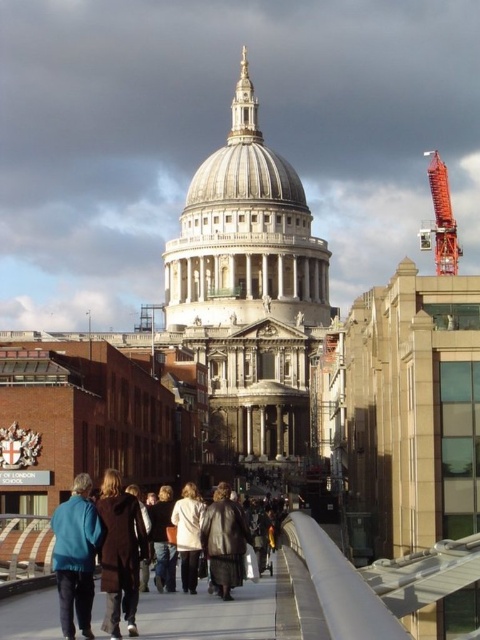
You are a tourist standing in front of St. Paul Cathedral and see a leather jacket at center and an orange metallic crane at upper right. Which object is nearer to you?

The leather jacket at center is closer to the viewer than the orange metallic crane at upper right.

You are a tourist standing on the pedestrian bridge and want to take a photo of St. Paul Cathedral. You notice a leather jacket at center and an orange metallic crane at upper right in your viewfinder. Which object should you adjust your camera to focus on first if you want both the cathedral and the crane to be in the frame?

You should focus on the orange metallic crane at upper right first because the leather jacket at center is positioned under it, so adjusting for the crane ensures the jacket remains in view while framing the cathedral.

You are standing on the pedestrian bridge in the image and notice two items below you. One is dark brown leather shoes at lower center and the other is white matte coat at center. Which item appears smaller in size?

The dark brown leather shoes at lower center appears smaller than the white matte coat at center according to the description.